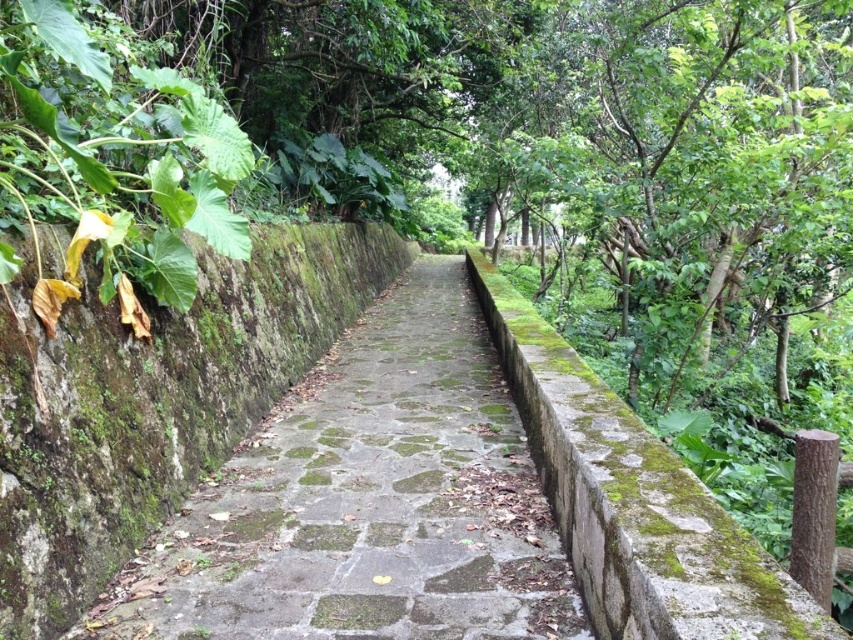
You are a hiker trying to navigate the narrow stone path through the forest. You see the green mossy stone path at center and the green leafy plant at left. Which object is positioned to the right of the other?

The green mossy stone path at center is to the right of the green leafy plant at left.

You are a hiker carrying a 1.5 meter wide tent. You come across the green mossy stone path at center and the green leafy plant at left. Can you tell me if the path is wide enough to set up your tent without disturbing the plant?

The green mossy stone path at center is wider than the green leafy plant at left. Since the path is wider, it should be wide enough to set up your 1.5 meter wide tent without disturbing the plant.

You are a hiker carrying a backpack and need to cross the green mossy stone path at center. The path is 2.67 meters away from you. If your backpack is 1.5 meters long, can you safely walk through the path without the backpack hitting the low stone walls on either side?

The green mossy stone path at center is 2.67 meters away from the camera. Since the backpack is 1.5 meters long, which is shorter than the path width, you can safely walk through the path without the backpack hitting the low stone walls on either side.